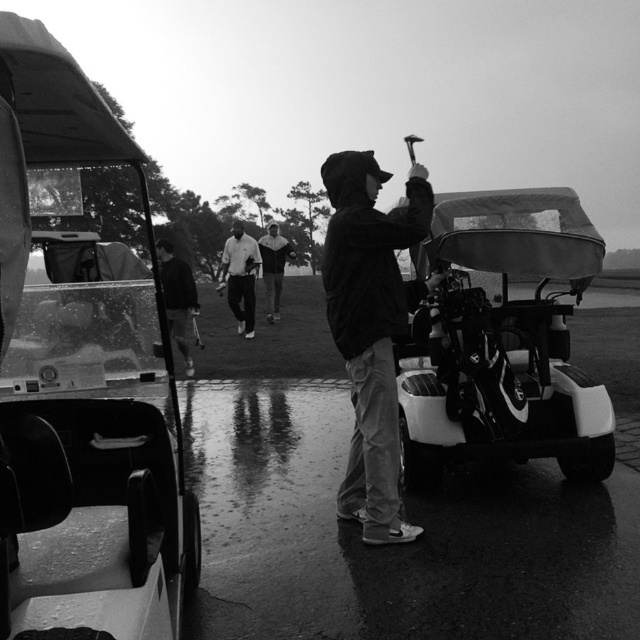
Question: Which object appears closest to the camera in this image?

Choices:
 (A) dark matte jacket at center
 (B) dark gray hoodie at center
 (C) dark fabric jacket at left
 (D) white cotton shirt at center

Answer: (A)

Question: Does metallic golf cart at left have a smaller size compared to white matte golf cart at center?

Choices:
 (A) no
 (B) yes

Answer: (A)

Question: Which of the following is the closest to the observer?

Choices:
 (A) metallic golf cart at left
 (B) white matte golf cart at center
 (C) dark matte jacket at center
 (D) white cotton shirt at center

Answer: (A)

Question: Is dark matte jacket at center smaller than dark gray hoodie at center?

Choices:
 (A) no
 (B) yes

Answer: (B)

Question: Among these points, which one is nearest to the camera?

Choices:
 (A) coord(522,337)
 (B) coord(241,284)
 (C) coord(100,577)
 (D) coord(369,465)

Answer: (C)

Question: Can you confirm if dark matte jacket at center is bigger than dark fabric jacket at left?

Choices:
 (A) no
 (B) yes

Answer: (B)